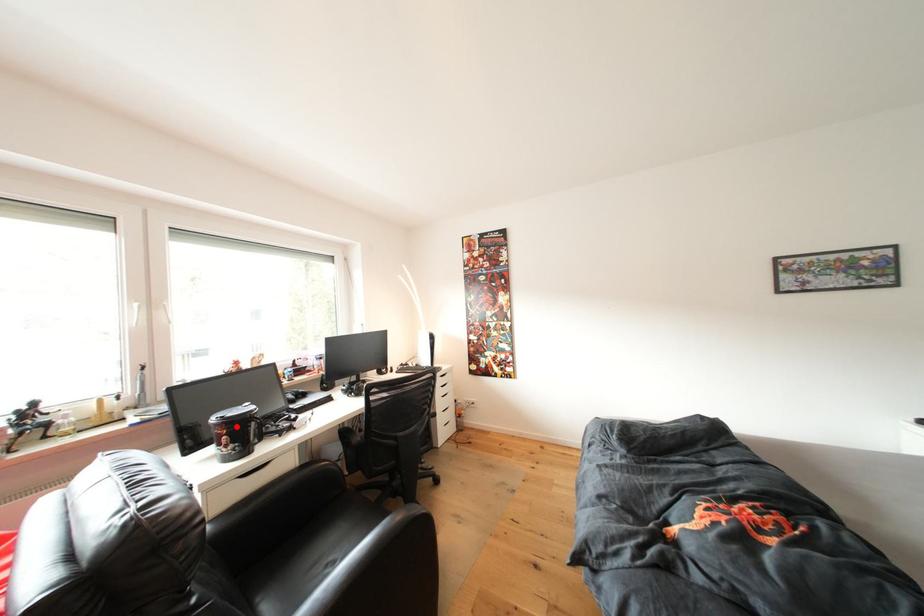
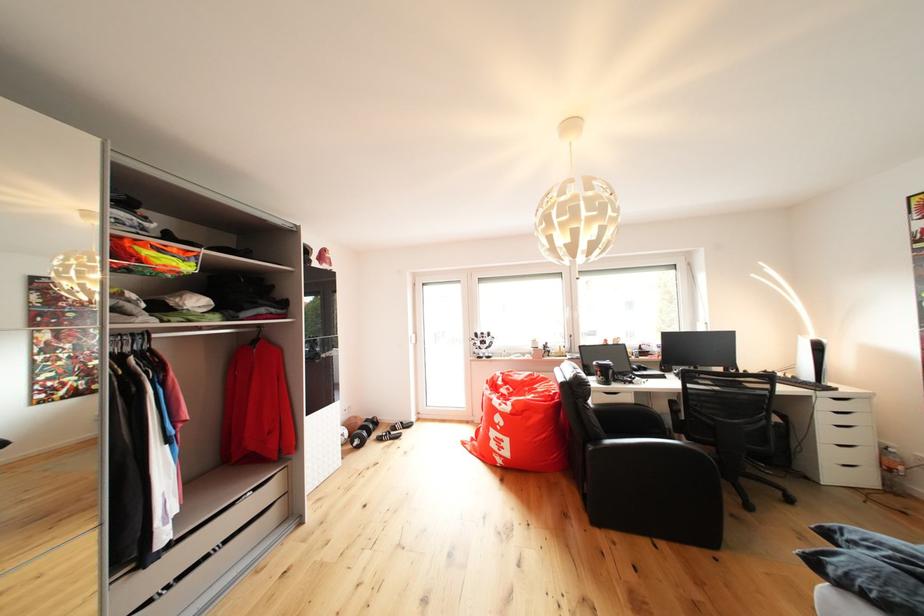
Question: I am providing you with two images of the same scene from different viewpoints. A red point is marked on the first image. Can you still see the location of the red point in image 2?

Choices:
 (A) Yes
 (B) No

Answer: (A)